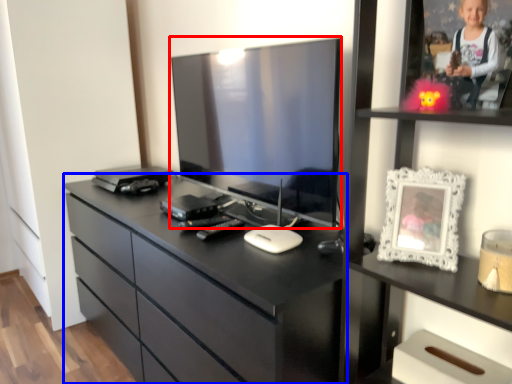
Question: Which point is closer to the camera, television (highlighted by a red box) or chest of drawers (highlighted by a blue box)?

Choices:
 (A) television
 (B) chest of drawers

Answer: (B)